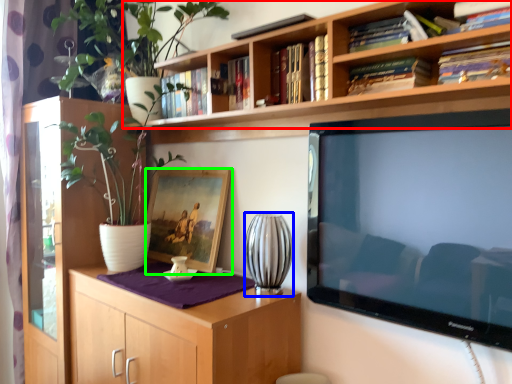
Question: Which object is positioned closest to bookcase (highlighted by a red box)? Select from vase (highlighted by a blue box) and picture frame (highlighted by a green box).

Choices:
 (A) vase
 (B) picture frame

Answer: (A)